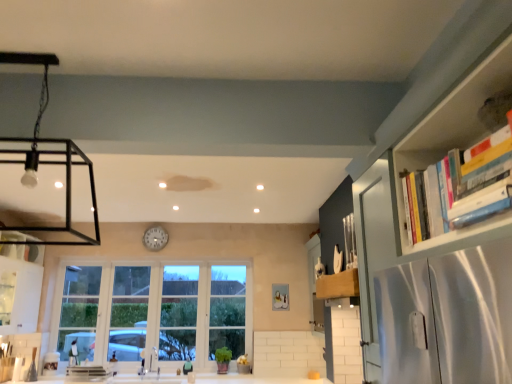
Question: From the image's perspective, is hardcover books at upper right positioned above or below white glossy clock at center?

Choices:
 (A) above
 (B) below

Answer: (A)

Question: In the image, is hardcover books at upper right positioned in front of or behind white glossy clock at center?

Choices:
 (A) behind
 (B) front

Answer: (B)

Question: Estimate the real-world distances between objects in this image. Which object is farther from the wooden knife block at upper right, which is the first cabinetry in right-to-left order?

Choices:
 (A) white glossy cabinet at left, the second cabinetry from the right
 (B) white glossy clock at center
 (C) matte black light fixture at upper left
 (D) metallic silver sink at lower center
 (E) hardcover books at upper right

Answer: (A)

Question: Which of these objects is positioned farthest from the clear glass window at center?

Choices:
 (A) white glossy cabinet at left, placed as the 1th cabinetry when sorted from left to right
 (B) wooden knife block at upper right, which is the first cabinetry in right-to-left order
 (C) white glossy clock at center
 (D) metallic silver sink at lower center
 (E) matte black light fixture at upper left

Answer: (B)